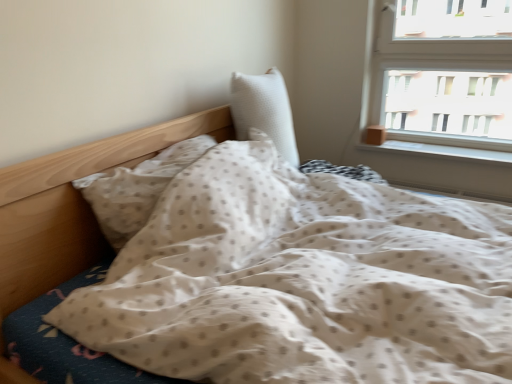
Measure the distance between white smooth window sill at right and camera.

white smooth window sill at right is 7.40 feet away from camera.

This screenshot has height=384, width=512. Identify the location of white textured pillow at center, the second pillow positioned from the left. (264, 110).

The width and height of the screenshot is (512, 384). I want to click on white smooth window sill at right, so click(x=442, y=147).

Is white dotted fabric pillow at center, the second pillow viewed from the right, positioned behind white smooth window sill at right?

No, the depth of white dotted fabric pillow at center, the second pillow viewed from the right, is less than that of white smooth window sill at right.

Is white dotted fabric pillow at center, positioned as the first pillow in left-to-right order, positioned far away from white smooth window sill at right?

That's right, there is a large distance between white dotted fabric pillow at center, positioned as the first pillow in left-to-right order, and white smooth window sill at right.

Considering the relative positions of white dotted fabric pillow at center, the second pillow viewed from the right, and white smooth window sill at right in the image provided, is white dotted fabric pillow at center, the second pillow viewed from the right, to the right of white smooth window sill at right from the viewer's perspective?

No, white dotted fabric pillow at center, the second pillow viewed from the right, is not to the right of white smooth window sill at right.

Who is bigger, white dotted fabric pillow at center, positioned as the first pillow in left-to-right order, or white smooth window sill at right?

white dotted fabric pillow at center, positioned as the first pillow in left-to-right order, is bigger.

Considering the points (416, 151) and (297, 150), which point is in front, point (416, 151) or point (297, 150)?

The point (416, 151) is in front.

From the image's perspective, which is above, white smooth window sill at right or white textured pillow at center, the first pillow viewed from the right?

white textured pillow at center, the first pillow viewed from the right, is shown above in the image.

I want to click on window sill behind the white textured pillow at center, the first pillow viewed from the right, so click(x=442, y=147).

Which of these two, white smooth window sill at right or white textured pillow at center, the second pillow positioned from the left, is bigger?

white textured pillow at center, the second pillow positioned from the left.

The image size is (512, 384). Find the location of `pillow behind the white dotted fabric pillow at center, positioned as the first pillow in left-to-right order`. pillow behind the white dotted fabric pillow at center, positioned as the first pillow in left-to-right order is located at coordinates (264, 110).

Looking at the image, does white textured pillow at center, the first pillow viewed from the right, seem bigger or smaller compared to white dotted fabric pillow at center, the second pillow viewed from the right?

white textured pillow at center, the first pillow viewed from the right, is bigger than white dotted fabric pillow at center, the second pillow viewed from the right.

From the image's perspective, is white textured pillow at center, the second pillow positioned from the left, beneath white dotted fabric pillow at center, the second pillow viewed from the right?

No, from the image's perspective, white textured pillow at center, the second pillow positioned from the left, is not below white dotted fabric pillow at center, the second pillow viewed from the right.

Considering the relative sizes of white textured pillow at center, the second pillow positioned from the left, and white dotted fabric pillow at center, the second pillow viewed from the right, in the image provided, is white textured pillow at center, the second pillow positioned from the left, thinner than white dotted fabric pillow at center, the second pillow viewed from the right,?

In fact, white textured pillow at center, the second pillow positioned from the left, might be wider than white dotted fabric pillow at center, the second pillow viewed from the right.

Is white textured pillow at center, the second pillow positioned from the left, to the right of white smooth window sill at right from the viewer's perspective?

No.

Based on their sizes in the image, would you say white textured pillow at center, the first pillow viewed from the right, is bigger or smaller than white smooth window sill at right?

Considering their sizes, white textured pillow at center, the first pillow viewed from the right, takes up more space than white smooth window sill at right.

Could you tell me if white textured pillow at center, the second pillow positioned from the left, is turned towards white smooth window sill at right?

No, white textured pillow at center, the second pillow positioned from the left, does not turn towards white smooth window sill at right.

From the image's perspective, between white textured pillow at center, the first pillow viewed from the right, and white smooth window sill at right, which one is located above?

white textured pillow at center, the first pillow viewed from the right, from the image's perspective.

Is white smooth window sill at right positioned beyond the bounds of white dotted fabric pillow at center, positioned as the first pillow in left-to-right order?

white smooth window sill at right is positioned outside white dotted fabric pillow at center, positioned as the first pillow in left-to-right order.

Which pillow is the 2nd one when counting from the front of the white smooth window sill at right? Please provide its 2D coordinates.

[(136, 188)]

From the image's perspective, relative to white dotted fabric pillow at center, positioned as the first pillow in left-to-right order, is white smooth window sill at right above or below?

Clearly, from the image's perspective, white smooth window sill at right is above white dotted fabric pillow at center, positioned as the first pillow in left-to-right order.

Considering the positions of objects white dotted fabric pillow at center, positioned as the first pillow in left-to-right order, and white textured pillow at center, the second pillow positioned from the left, in the image provided, who is in front, white dotted fabric pillow at center, positioned as the first pillow in left-to-right order, or white textured pillow at center, the second pillow positioned from the left,?

white dotted fabric pillow at center, positioned as the first pillow in left-to-right order, is closer to the camera.

From a real-world perspective, between white dotted fabric pillow at center, the second pillow viewed from the right, and white textured pillow at center, the first pillow viewed from the right, who is vertically higher?

white textured pillow at center, the first pillow viewed from the right.

Which object is positioned more to the left, white dotted fabric pillow at center, the second pillow viewed from the right, or white textured pillow at center, the second pillow positioned from the left?

white dotted fabric pillow at center, the second pillow viewed from the right, is more to the left.

Considering the relative sizes of white dotted fabric pillow at center, positioned as the first pillow in left-to-right order, and white textured pillow at center, the second pillow positioned from the left, in the image provided, is white dotted fabric pillow at center, positioned as the first pillow in left-to-right order, shorter than white textured pillow at center, the second pillow positioned from the left,?

Indeed, white dotted fabric pillow at center, positioned as the first pillow in left-to-right order, has a lesser height compared to white textured pillow at center, the second pillow positioned from the left.

Locate an element on the screen. This screenshot has height=384, width=512. window sill above the white dotted fabric pillow at center, positioned as the first pillow in left-to-right order (from the image's perspective) is located at coordinates (442, 147).

Locate an element on the screen. The width and height of the screenshot is (512, 384). window sill behind the white textured pillow at center, the first pillow viewed from the right is located at coordinates (442, 147).

When comparing their distances from white textured pillow at center, the first pillow viewed from the right, does white smooth window sill at right or white dotted fabric pillow at center, positioned as the first pillow in left-to-right order, seem further?

white smooth window sill at right lies further to white textured pillow at center, the first pillow viewed from the right, than the other object.

Looking at the image, which one is located further to white smooth window sill at right, white dotted fabric pillow at center, positioned as the first pillow in left-to-right order, or white textured pillow at center, the first pillow viewed from the right?

white dotted fabric pillow at center, positioned as the first pillow in left-to-right order, is positioned further to the anchor white smooth window sill at right.

Looking at the image, which one is located closer to white dotted fabric pillow at center, the second pillow viewed from the right, white smooth window sill at right or white textured pillow at center, the second pillow positioned from the left?

Among the two, white textured pillow at center, the second pillow positioned from the left, is located nearer to white dotted fabric pillow at center, the second pillow viewed from the right.

Estimate the real-world distances between objects in this image. Which object is further from white textured pillow at center, the second pillow positioned from the left, white dotted fabric pillow at center, the second pillow viewed from the right, or white smooth window sill at right?

white smooth window sill at right is positioned further to the anchor white textured pillow at center, the second pillow positioned from the left.

Considering their positions, is white textured pillow at center, the second pillow positioned from the left, positioned further to white dotted fabric pillow at center, the second pillow viewed from the right, than white smooth window sill at right?

Among the two, white smooth window sill at right is located further to white dotted fabric pillow at center, the second pillow viewed from the right.

When comparing their distances from white smooth window sill at right, does white textured pillow at center, the first pillow viewed from the right, or white dotted fabric pillow at center, the second pillow viewed from the right, seem further?

The object further to white smooth window sill at right is white dotted fabric pillow at center, the second pillow viewed from the right.

The height and width of the screenshot is (384, 512). I want to click on pillow situated between white dotted fabric pillow at center, positioned as the first pillow in left-to-right order, and white smooth window sill at right from left to right, so click(x=264, y=110).